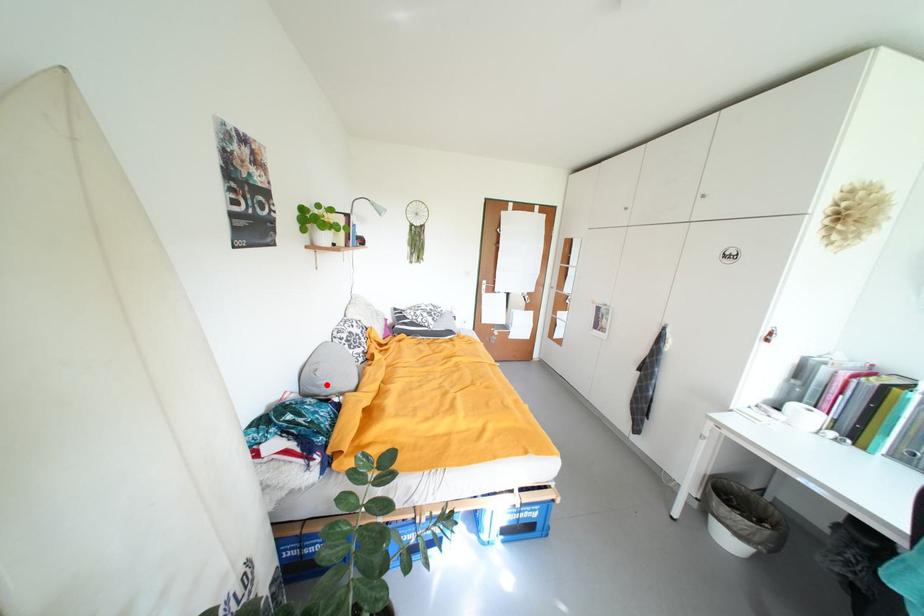
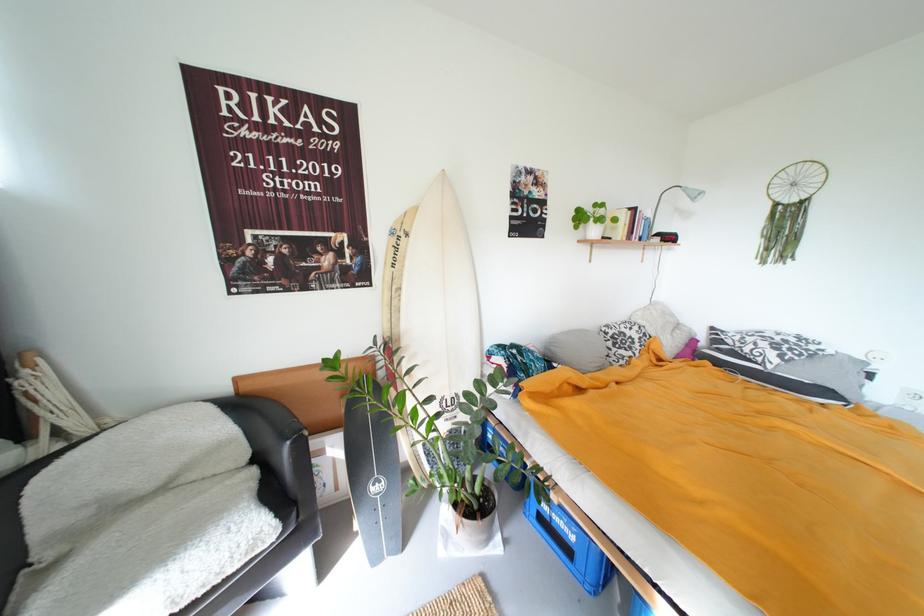
Question: I am providing you with two images of the same scene from different viewpoints. Image1 has a red point marked. In image2, the corresponding 3D location appears at what relative position? Reply with the corresponding letter.

Choices:
 (A) Closer
 (B) Farther

Answer: (B)